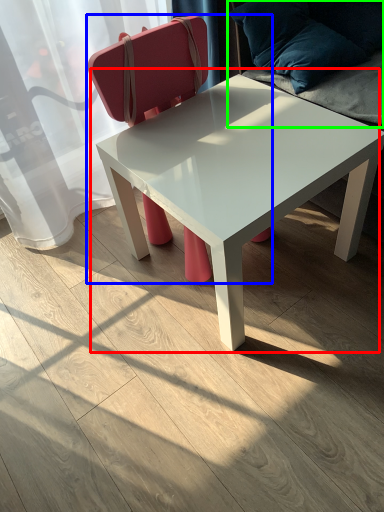
Question: Which is farther away from coffee table (highlighted by a red box)? chair (highlighted by a blue box) or swivel chair (highlighted by a green box)?

Choices:
 (A) chair
 (B) swivel chair

Answer: (A)